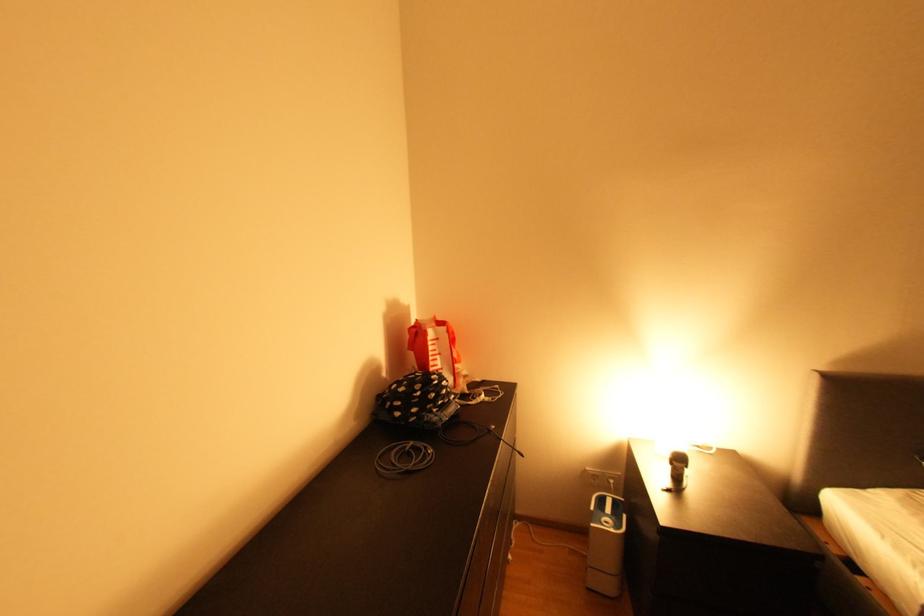
Locate an element on the screen. white device handle is located at coordinates (608, 512).